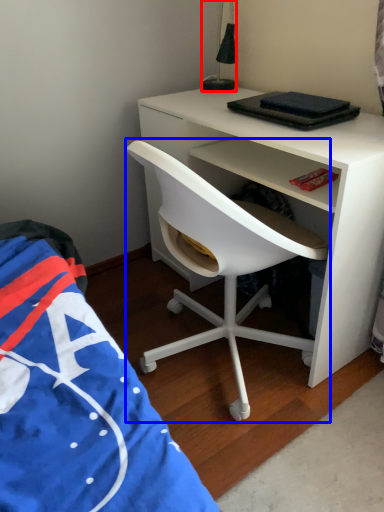
Question: Which of the following is the farthest to the observer, lamp (highlighted by a red box) or chair (highlighted by a blue box)?

Choices:
 (A) lamp
 (B) chair

Answer: (A)